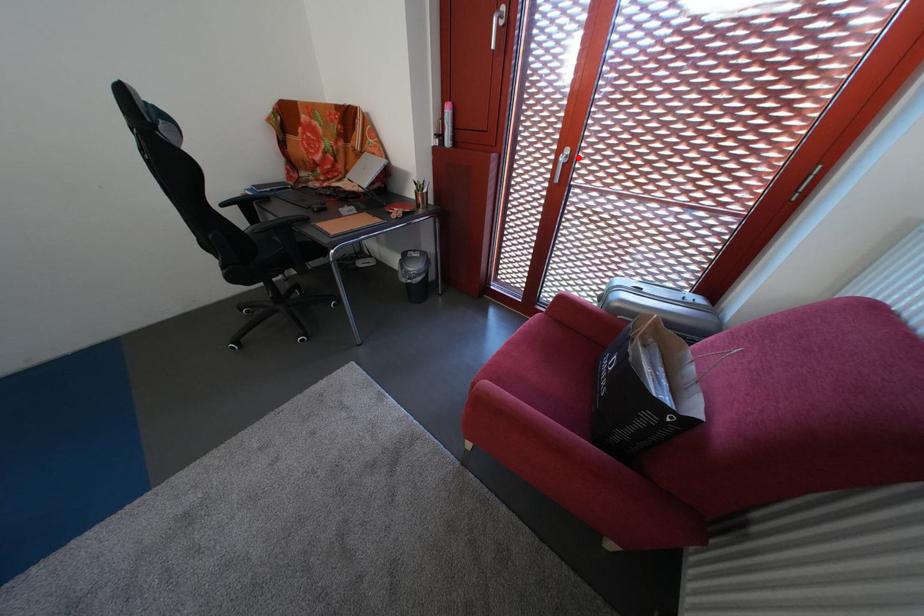
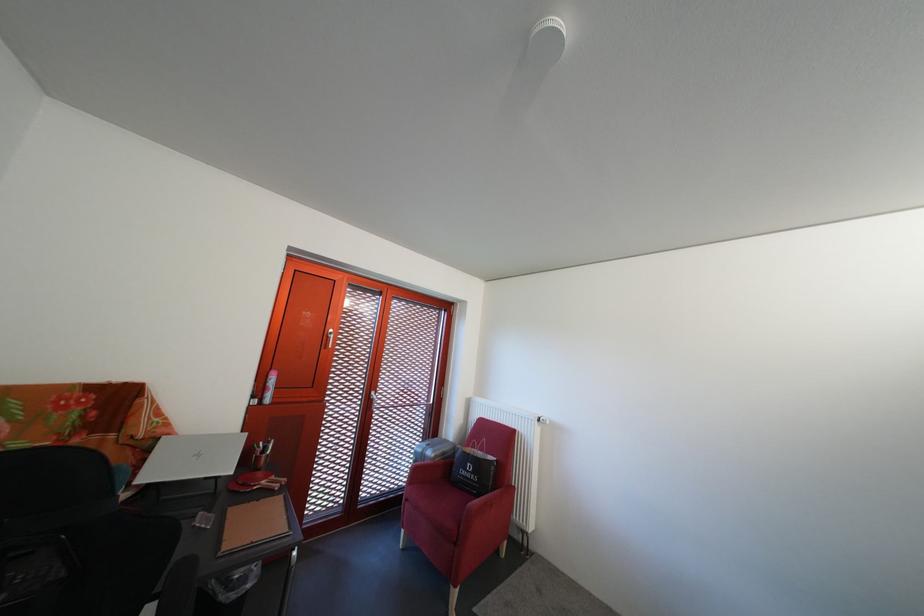
In the second image, find the point that corresponds to the highlighted location in the first image.

(383, 400)